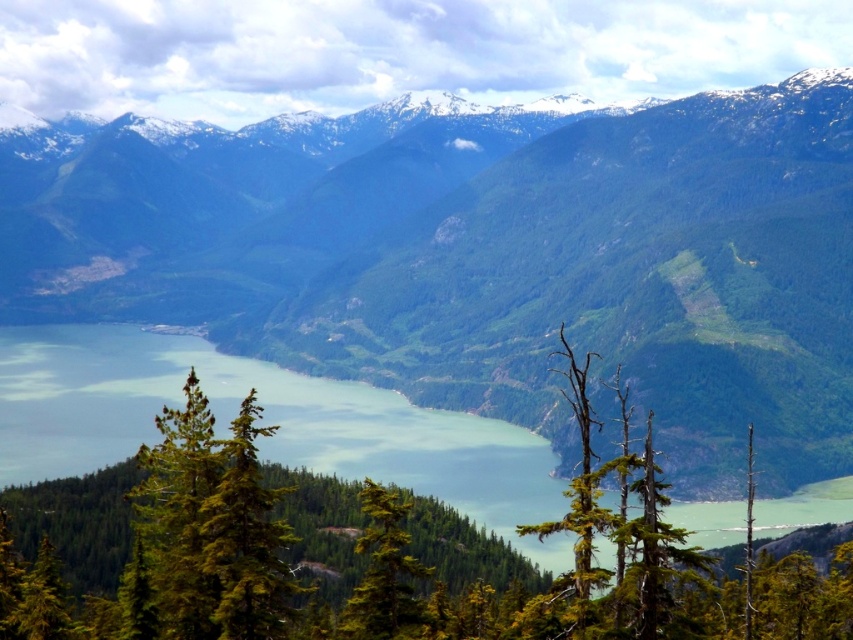
Question: Which object is farther from the camera taking this photo?

Choices:
 (A) green forested mountain range at center
 (B) green needle-like tree at center

Answer: (A)

Question: Considering the real-world distances, which object is farthest from the green forested mountain range at center?

Choices:
 (A) green water at center
 (B) green needle-like tree at center

Answer: (B)

Question: Can you confirm if green needle-like tree at center is positioned below green matte tree at center?

Choices:
 (A) yes
 (B) no

Answer: (B)

Question: Does green needle-like tree at center appear on the right side of green matte tree at center?

Choices:
 (A) yes
 (B) no

Answer: (B)

Question: Does green needle-like tree at center appear under green matte tree at center?

Choices:
 (A) no
 (B) yes

Answer: (A)

Question: Which point is closer to the camera?

Choices:
 (A) (376, 500)
 (B) (701, 416)

Answer: (A)